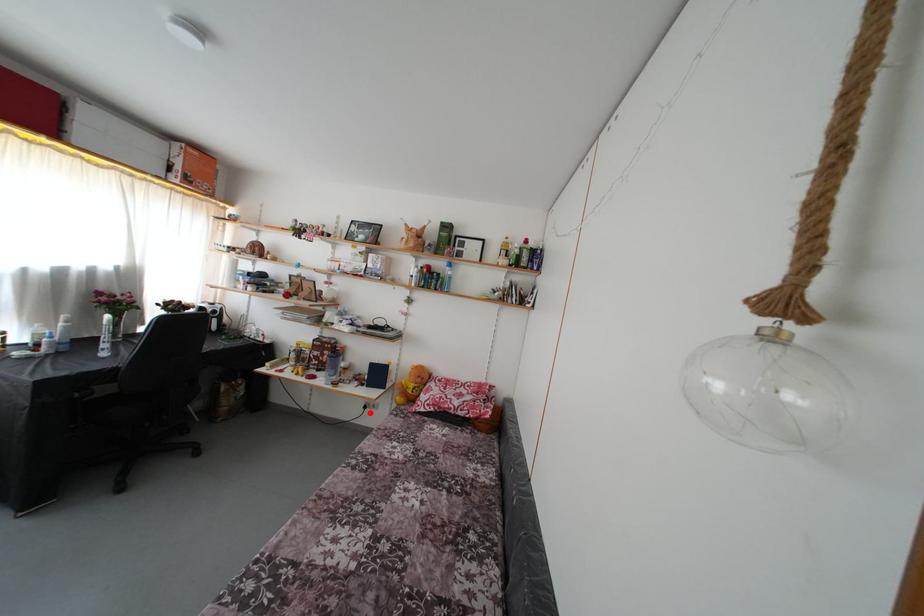
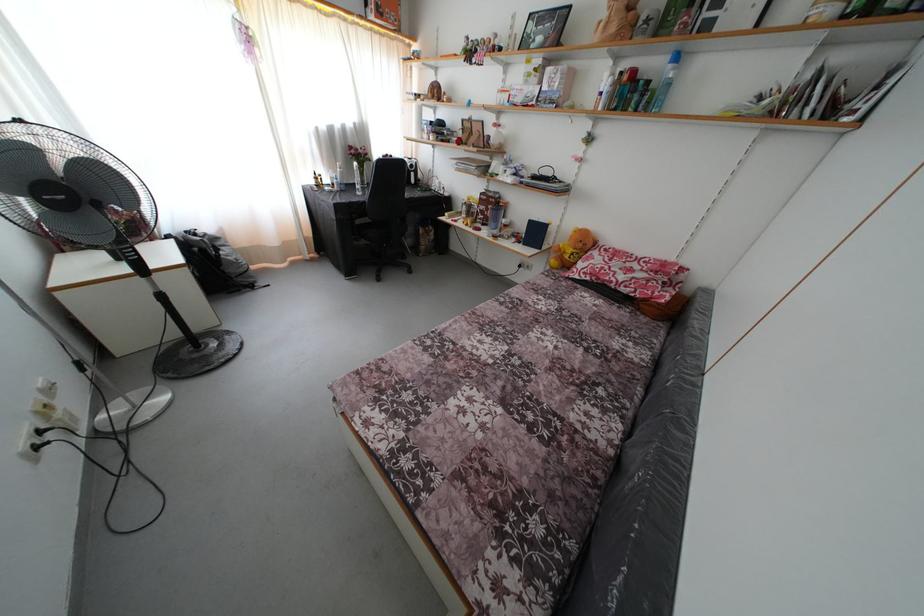
Locate, in the second image, the point that corresponds to the highlighted location in the first image.

(525, 272)